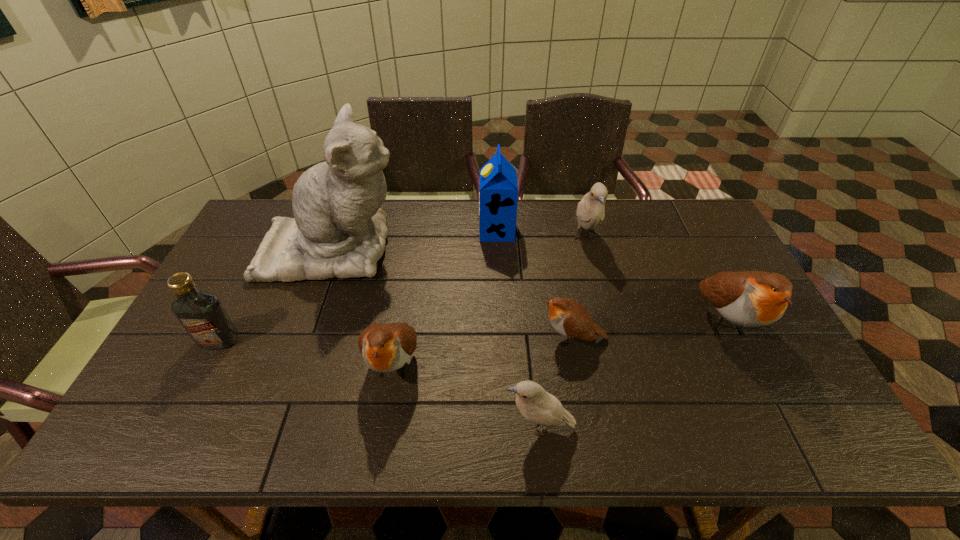
This screenshot has width=960, height=540. What are the coordinates of `cat that is at the left edge` in the screenshot? It's located at click(x=339, y=230).

Where is `vodka situated at the left edge`? Image resolution: width=960 pixels, height=540 pixels. vodka situated at the left edge is located at coordinates (202, 315).

Identify the location of object situated at the right edge. This screenshot has width=960, height=540. (748, 298).

You are a GUI agent. You are given a task and a screenshot of the screen. Output one action in this format:
    pyautogui.click(x=<x>, y=<y>)
    Task: Click on the object that is at the far left corner
    The image size is (960, 540).
    Given the screenshot: What is the action you would take?
    pyautogui.click(x=339, y=230)

The height and width of the screenshot is (540, 960). Find the location of `vacant area at the far edge of the desktop`. vacant area at the far edge of the desktop is located at coordinates (400, 199).

Locate an element on the screen. vacant space at the near edge of the desktop is located at coordinates (485, 421).

Locate an element on the screen. free space at the right edge is located at coordinates (691, 255).

In the image, there is a desktop. In order to click on vacant space at the far left corner in this screenshot , I will do `click(263, 206)`.

The height and width of the screenshot is (540, 960). What are the coordinates of `vacant space at the far right corner of the desktop` in the screenshot? It's located at (683, 234).

Identify the location of vacant space at the near right corner of the desktop. (787, 432).